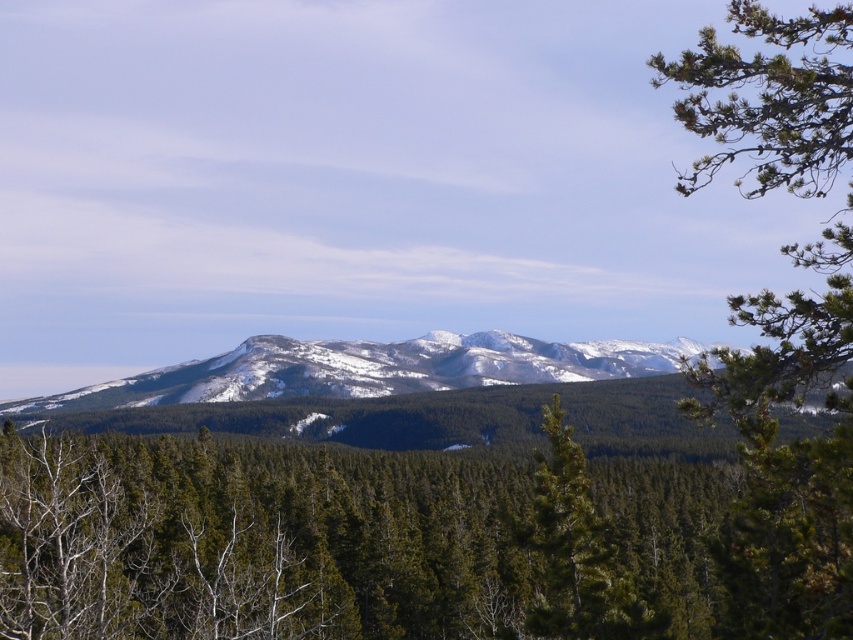
You are a hiker planning to take a photo of both the snowy rocky mountain range at center and the green matte tree at center. Which object should you position to your left to capture both in the frame?

The snowy rocky mountain range at center is positioned on the left side of the green matte tree at center. To capture both in the frame, you should position the snowy rocky mountain range at center to your left and the green matte tree at center to your right.